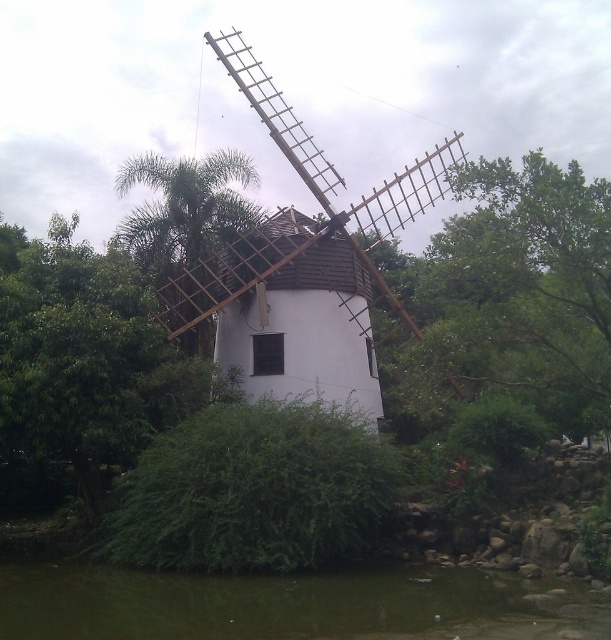
Is point (420, 396) behind point (97, 432)?

Yes, it is.

From the picture: Who is taller, green leafy tree at upper right or green leafy tree at left?

green leafy tree at upper right

Does point (587, 388) lie in front of point (155, 381)?

Yes, point (587, 388) is in front of point (155, 381).

At what (x,y) coordinates should I click in order to perform the action: click on green leafy tree at upper right. Please return your answer as a coordinate pair (x, y). This screenshot has width=611, height=640. Looking at the image, I should click on (510, 298).

The height and width of the screenshot is (640, 611). What are the coordinates of `white wooden windmill at center` in the screenshot? It's located at (302, 264).

Can you confirm if white wooden windmill at center is bigger than green leafy tree at left?

Yes.

Identify the location of white wooden windmill at center. (302, 264).

Between green leafy tree at left and green leafy palm at center, which one has less height?

green leafy tree at left is shorter.

The image size is (611, 640). I want to click on green leafy tree at left, so click(x=78, y=371).

At what (x,y) coordinates should I click in order to perform the action: click on green leafy tree at left. Please return your answer as a coordinate pair (x, y). Looking at the image, I should click on (78, 371).